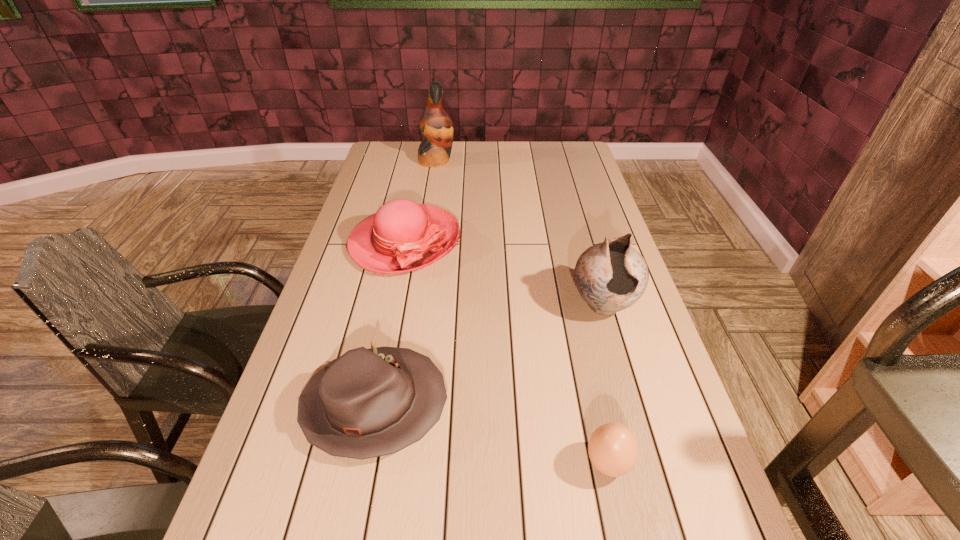
The image size is (960, 540). Identify the location of vacant space situated 0.250m at the front of the third tallest object with a bow. (383, 348).

Find the location of a particular element. blank space located 0.400m on the decorative side of the shorter hat is located at coordinates (632, 405).

You are a GUI agent. You are given a task and a screenshot of the screen. Output one action in this format:
    pyautogui.click(x=<x>, y=<y>)
    Task: Click on the vacant region located on the left of the boiled egg
    This screenshot has height=540, width=960.
    Given the screenshot: What is the action you would take?
    pyautogui.click(x=544, y=463)

This screenshot has width=960, height=540. Identify the location of object situated at the far edge. (436, 125).

You are a GUI agent. You are given a task and a screenshot of the screen. Output one action in this format:
    pyautogui.click(x=<x>, y=<y>)
    Task: Click on the pottery present at the right edge
    The image size is (960, 540).
    Given the screenshot: What is the action you would take?
    click(x=611, y=276)

The image size is (960, 540). Find the location of `boiled egg present at the right edge`. boiled egg present at the right edge is located at coordinates (612, 448).

This screenshot has width=960, height=540. In the image, there is a desktop. Find the location of `free space at the far edge`. free space at the far edge is located at coordinates (502, 166).

At what (x,y) coordinates should I click in order to perform the action: click on vacant point at the left edge. Please return your answer as a coordinate pair (x, y). Looking at the image, I should click on (310, 498).

The image size is (960, 540). I want to click on blank space at the right edge, so click(666, 411).

What are the coordinates of `vacant space at the far right corner` in the screenshot? It's located at (569, 155).